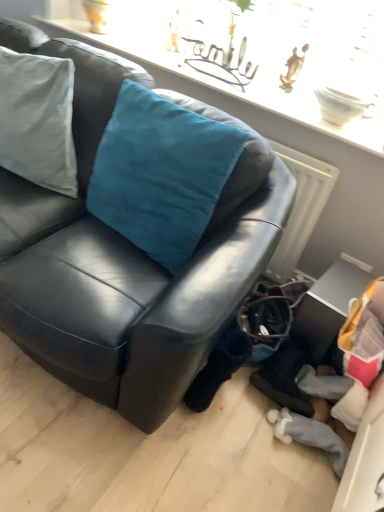
The height and width of the screenshot is (512, 384). Identify the location of empty space that is ontop of metallic silver table at lower right (from a real-world perspective). (352, 282).